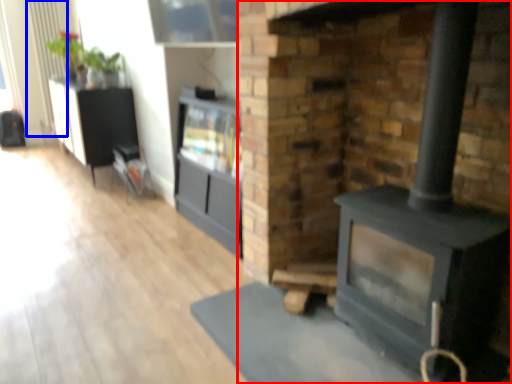
Question: Which point is closer to the camera, fireplace (highlighted by a red box) or radiator (highlighted by a blue box)?

Choices:
 (A) fireplace
 (B) radiator

Answer: (A)